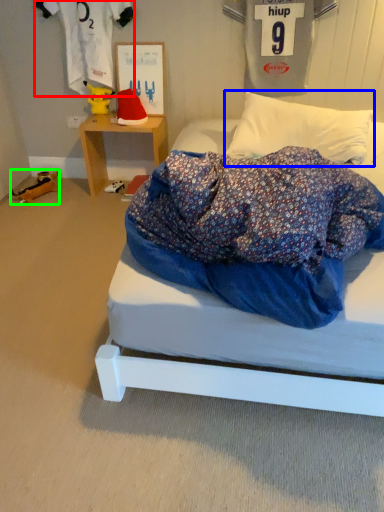
Question: Based on their relative distances, which object is farther from clothing (highlighted by a red box)? Choose from pillow (highlighted by a blue box) and toy (highlighted by a green box).

Choices:
 (A) pillow
 (B) toy

Answer: (A)